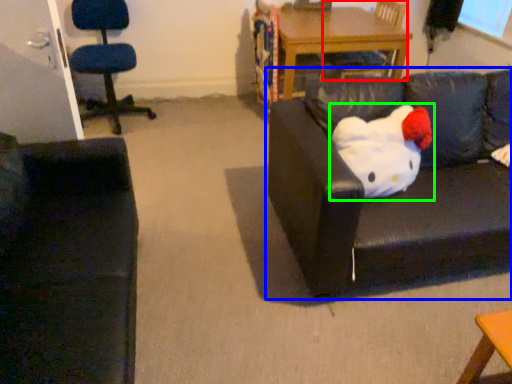
Question: Which object is positioned closest to chair (highlighted by a red box)? Select from studio couch (highlighted by a blue box) and toy (highlighted by a green box).

Choices:
 (A) studio couch
 (B) toy

Answer: (A)